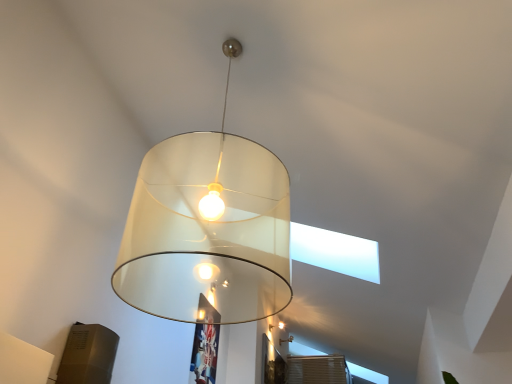
Question: Could you tell me if translucent white lampshade at center, the 1th lamp viewed from the front, is facing translucent glass lampshade at center, marked as the 2th lamp in a left-to-right arrangement?

Choices:
 (A) yes
 (B) no

Answer: (A)

Question: Does translucent white lampshade at center, the 1th lamp from the left, have a greater height compared to translucent glass lampshade at center, positioned as the 2th lamp in front-to-back order?

Choices:
 (A) yes
 (B) no

Answer: (A)

Question: Does translucent white lampshade at center, the 1th lamp viewed from the front, contain translucent glass lampshade at center, positioned as the 2th lamp in front-to-back order?

Choices:
 (A) no
 (B) yes

Answer: (A)

Question: Does translucent white lampshade at center, the 1th lamp viewed from the front, have a greater width compared to translucent glass lampshade at center, which appears as the first lamp when ordered from the bottom?

Choices:
 (A) yes
 (B) no

Answer: (A)

Question: Are translucent white lampshade at center, the 1th lamp from the top, and translucent glass lampshade at center, marked as the 2th lamp in a left-to-right arrangement, making contact?

Choices:
 (A) yes
 (B) no

Answer: (B)

Question: Considering the relative sizes of translucent white lampshade at center, the 1th lamp viewed from the front, and translucent glass lampshade at center, positioned as the 2th lamp in front-to-back order, in the image provided, is translucent white lampshade at center, the 1th lamp viewed from the front, bigger than translucent glass lampshade at center, positioned as the 2th lamp in front-to-back order,?

Choices:
 (A) no
 (B) yes

Answer: (B)

Question: Can you confirm if translucent glass lampshade at center, the first lamp from the right, is bigger than translucent white lampshade at center, the 1th lamp from the top?

Choices:
 (A) no
 (B) yes

Answer: (A)

Question: Does translucent glass lampshade at center, which appears as the first lamp when ordered from the bottom, have a lesser width compared to translucent white lampshade at center, which is the second lamp from right to left?

Choices:
 (A) no
 (B) yes

Answer: (B)

Question: Is translucent glass lampshade at center, acting as the 2th lamp starting from the top, taller than translucent white lampshade at center, which is the second lamp from right to left?

Choices:
 (A) yes
 (B) no

Answer: (B)

Question: From a real-world perspective, is translucent glass lampshade at center, marked as the 2th lamp in a left-to-right arrangement, over translucent white lampshade at center, the 1th lamp from the left?

Choices:
 (A) no
 (B) yes

Answer: (B)

Question: From the image's perspective, is translucent glass lampshade at center, the first lamp from the right, on top of translucent white lampshade at center, which is the second lamp from right to left?

Choices:
 (A) no
 (B) yes

Answer: (A)

Question: Does translucent glass lampshade at center, the first lamp from the right, appear on the right side of translucent white lampshade at center, which is the second lamp from right to left?

Choices:
 (A) yes
 (B) no

Answer: (A)

Question: Does point (203, 200) appear closer or farther from the camera than point (289, 337)?

Choices:
 (A) farther
 (B) closer

Answer: (B)